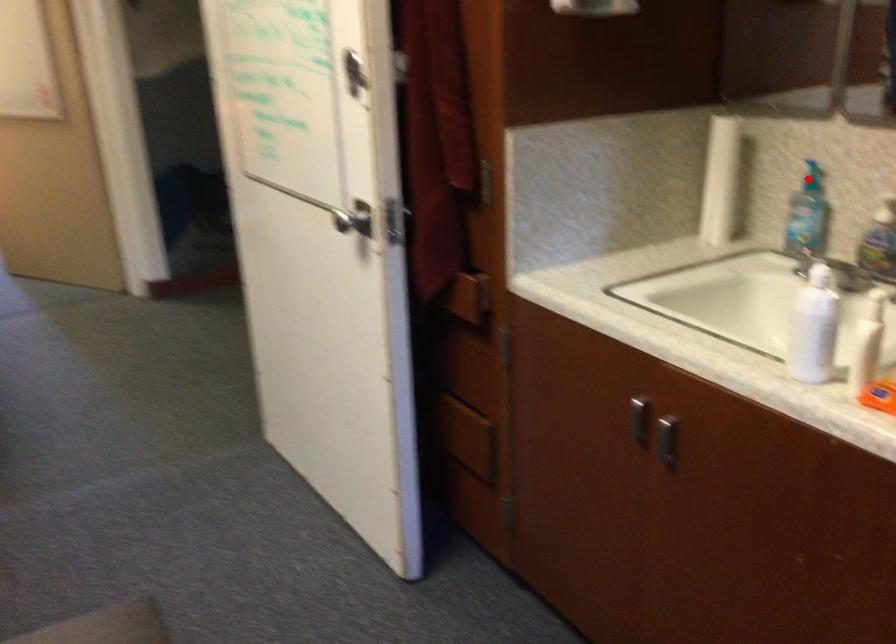
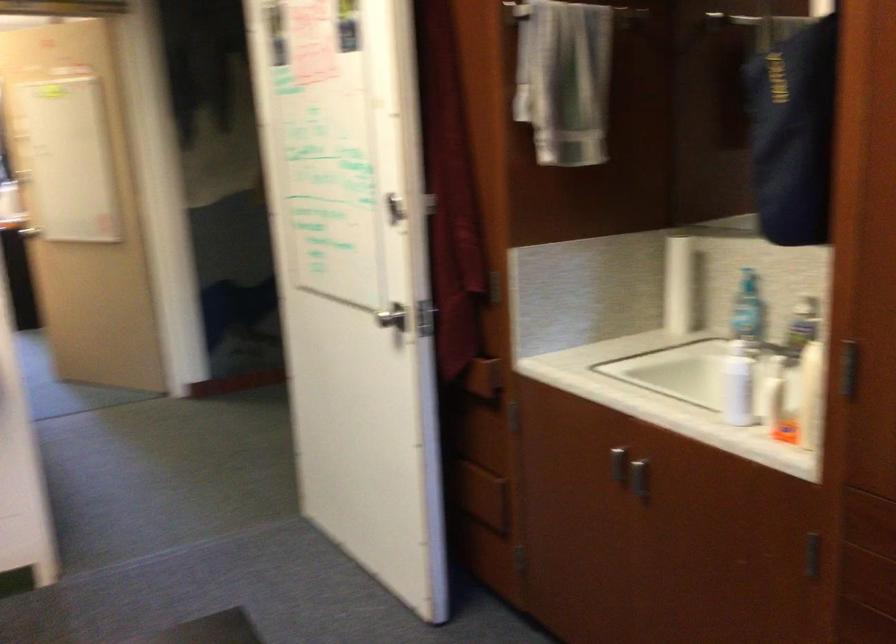
Question: I am providing you with two images of the same scene from different viewpoints. A red point is shown in image1. For the corresponding object point in image2, is it positioned nearer or farther from the camera?

Choices:
 (A) Nearer
 (B) Farther

Answer: (B)